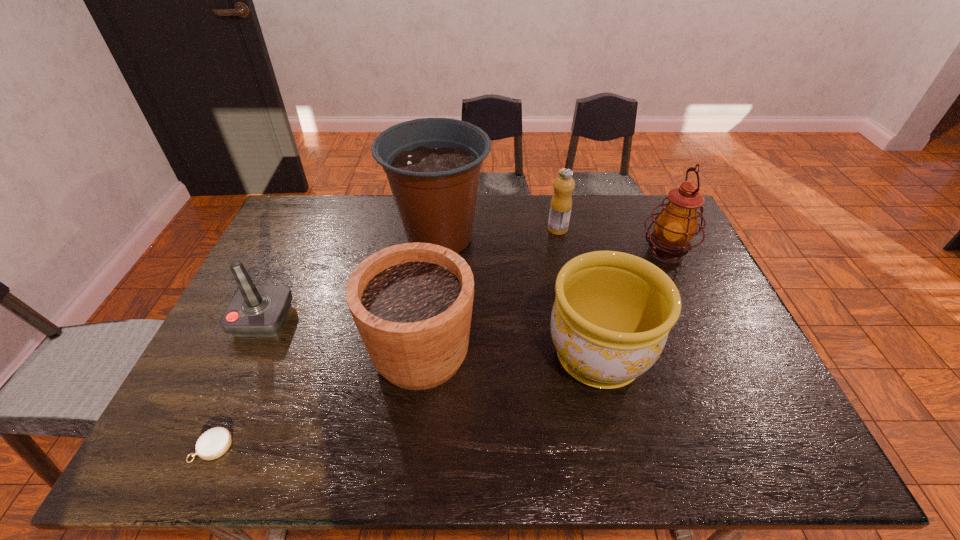
This screenshot has width=960, height=540. In order to click on empty space that is in between the shortest object and the farthest flowerpot in this screenshot , I will do `click(325, 342)`.

Locate an element on the screen. Image resolution: width=960 pixels, height=540 pixels. free spot between the tallest flowerpot and the fruit juice is located at coordinates (498, 234).

Locate an element on the screen. The width and height of the screenshot is (960, 540). vacant space in between the tallest flowerpot and the shortest object is located at coordinates click(x=325, y=342).

What are the coordinates of `object that is the second closest to the fruit juice` in the screenshot? It's located at pyautogui.click(x=676, y=225).

Choose which object is the fifth nearest neighbor to the fruit juice. Please provide its 2D coordinates. Your answer should be formatted as a tuple, i.e. [(x, y)], where the tuple contains the x and y coordinates of a point satisfying the conditions above.

[(255, 310)]

Locate which flowerpot ranks in proximity to the fruit juice. Please provide its 2D coordinates. Your answer should be formatted as a tuple, i.e. [(x, y)], where the tuple contains the x and y coordinates of a point satisfying the conditions above.

[(433, 165)]

In order to click on the second closest flowerpot to the rightmost flowerpot in this screenshot , I will do `click(433, 165)`.

Where is `vacant region that satisfies the following two spatial constraints: 1. on the back side of the shortest object; 2. on the right side of the tallest flowerpot`? vacant region that satisfies the following two spatial constraints: 1. on the back side of the shortest object; 2. on the right side of the tallest flowerpot is located at coordinates (305, 239).